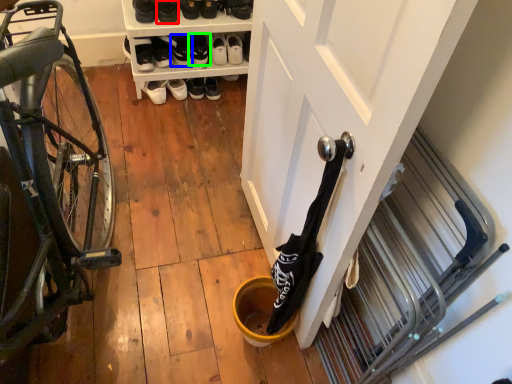
Question: Considering the real-world distances, which object is farthest from footwear (highlighted by a red box)? footwear (highlighted by a blue box) or footwear (highlighted by a green box)?

Choices:
 (A) footwear
 (B) footwear

Answer: (B)